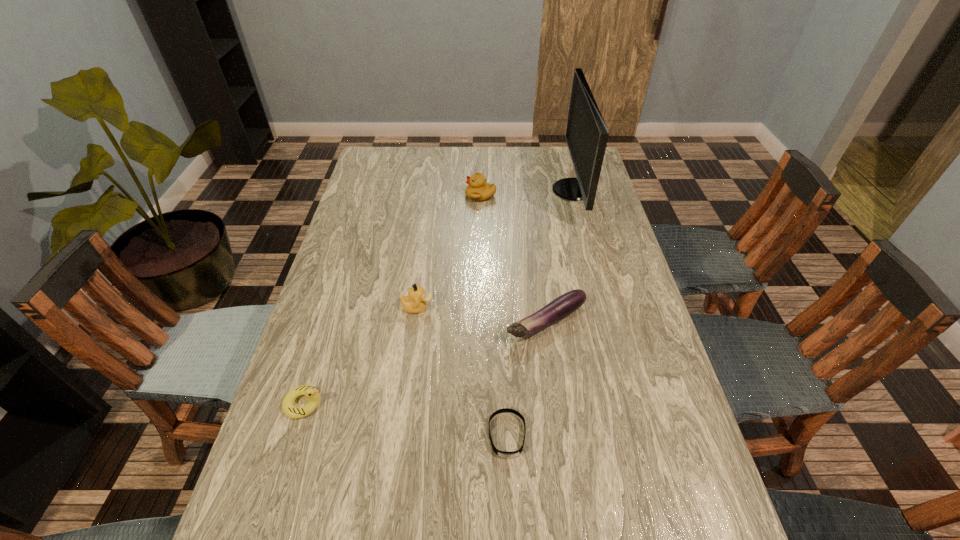
At what (x,y) coordinates should I click in order to perform the action: click on free area in between the shortest duckling and the computer monitor. Please return your answer as a coordinate pair (x, y). This screenshot has width=960, height=540. Looking at the image, I should click on (438, 297).

Identify the location of free area in between the eggplant and the tallest object. (560, 256).

Locate an element on the screen. unoccupied area between the farthest duckling and the eggplant is located at coordinates (514, 259).

Find the location of a particular element. This screenshot has width=960, height=540. free point between the nearest duckling and the computer monitor is located at coordinates (438, 297).

Where is `free point between the second duckling from right to left and the shortest object`? The width and height of the screenshot is (960, 540). free point between the second duckling from right to left and the shortest object is located at coordinates (463, 371).

In order to click on the third closest object to the eggplant in this screenshot , I will do `click(586, 135)`.

Where is `object that can be found as the fourth closest to the tallest object`? Image resolution: width=960 pixels, height=540 pixels. object that can be found as the fourth closest to the tallest object is located at coordinates coord(504,454).

Identify which duckling is the second nearest to the leftmost duckling. Please provide its 2D coordinates. Your answer should be formatted as a tuple, i.e. [(x, y)], where the tuple contains the x and y coordinates of a point satisfying the conditions above.

[(478, 189)]

Point out which duckling is positioned as the nearest to the leftmost object. Please provide its 2D coordinates. Your answer should be formatted as a tuple, i.e. [(x, y)], where the tuple contains the x and y coordinates of a point satisfying the conditions above.

[(415, 302)]

At what (x,y) coordinates should I click in order to perform the action: click on vacant point that satisfies the following two spatial constraints: 1. on the front-facing side of the rightmost duckling; 2. on the right side of the eggplant. Please return your answer as a coordinate pair (x, y). Image resolution: width=960 pixels, height=540 pixels. Looking at the image, I should click on (481, 322).